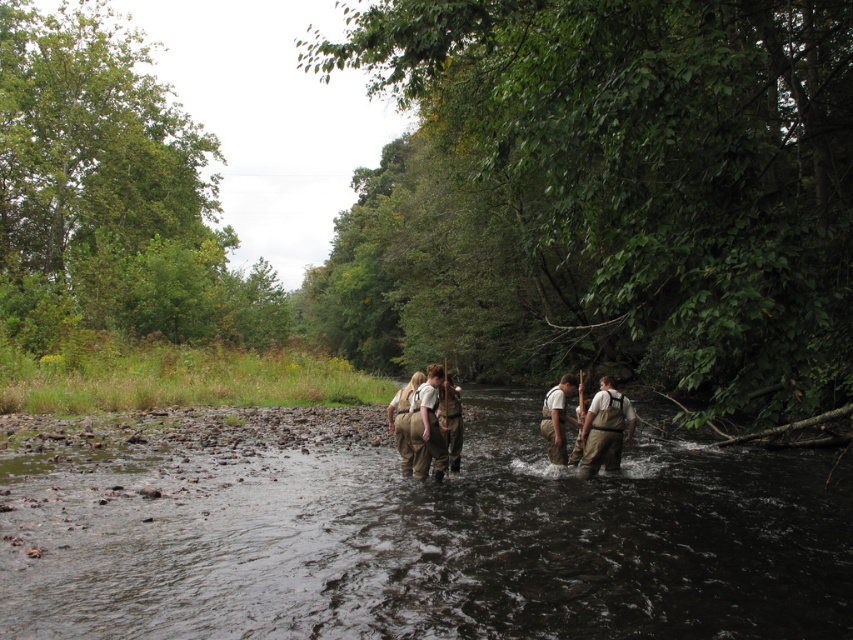
Question: Which is nearer to the brown waterproof pants at center?

Choices:
 (A) brown fabric river at center
 (B) brown fabric pants at center

Answer: (B)

Question: Is brown waterproof pants at center to the right of brown fabric backpack at center from the viewer's perspective?

Choices:
 (A) yes
 (B) no

Answer: (A)

Question: Which point appears farthest from the camera in this image?

Choices:
 (A) click(x=602, y=387)
 (B) click(x=426, y=381)
 (C) click(x=167, y=605)

Answer: (A)

Question: Can you confirm if brown cotton shirt at center is positioned to the left of brown leather backpack at center?

Choices:
 (A) yes
 (B) no

Answer: (A)

Question: Which object is the farthest from the brown fabric river at center?

Choices:
 (A) brown fabric pants at center
 (B) brown cotton shirt at center

Answer: (A)

Question: Can you confirm if brown fabric river at center is positioned below brown cotton shirt at center?

Choices:
 (A) no
 (B) yes

Answer: (B)